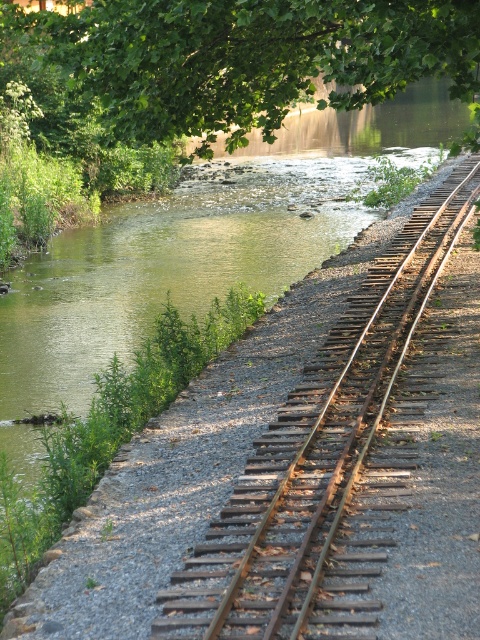
Which is more to the right, rusty metal train track at right or green leafy tree at upper center?

From the viewer's perspective, rusty metal train track at right appears more on the right side.

At what (x,y) coordinates should I click in order to perform the action: click on rusty metal train track at right. Please return your answer as a coordinate pair (x, y). The image size is (480, 640). Looking at the image, I should click on (321, 458).